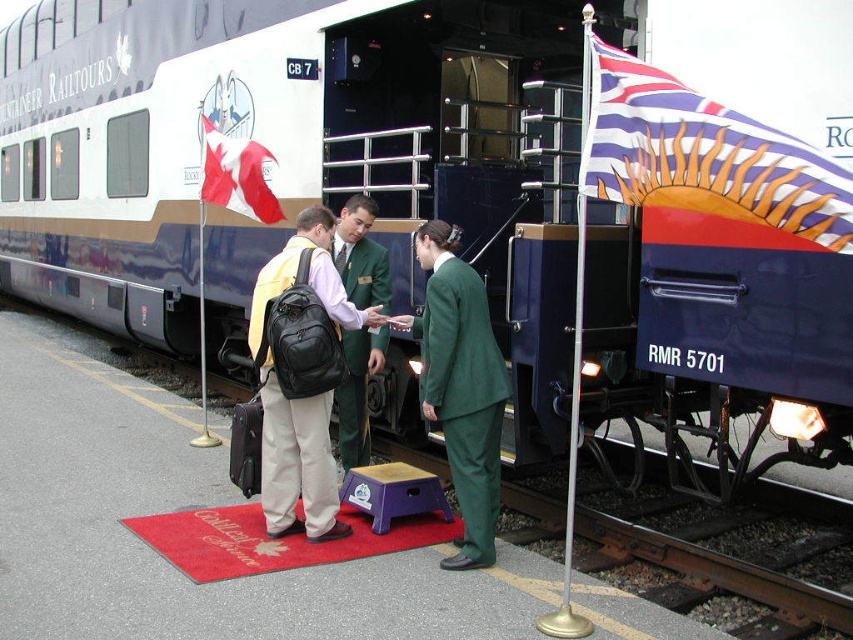
Can you confirm if striped fabric flag at right is positioned to the left of red fabric flag at upper left?

In fact, striped fabric flag at right is to the right of red fabric flag at upper left.

Is striped fabric flag at right wider than red fabric flag at upper left?

Indeed, striped fabric flag at right has a greater width compared to red fabric flag at upper left.

Locate an element on the screen. striped fabric flag at right is located at coordinates (701, 154).

Which is more to the left, green fabric suit at center or red fabric flag at upper left?

red fabric flag at upper left is more to the left.

Does point (445, 237) come closer to viewer compared to point (241, 188)?

Yes, it is.

Who is more distant from viewer, (485, 348) or (201, 196)?

Point (201, 196)

I want to click on green fabric suit at center, so click(461, 387).

Between green fabric uniform at center and red fabric flag at upper left, which one has more height?

green fabric uniform at center

Between point (358, 332) and point (215, 189), which one is positioned behind?

Positioned behind is point (215, 189).

Find the location of a particular element. This screenshot has width=853, height=640. green fabric uniform at center is located at coordinates (360, 256).

The image size is (853, 640). I want to click on green fabric uniform at center, so click(x=360, y=256).